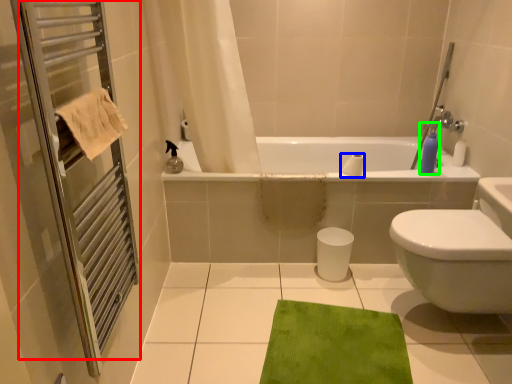
Question: Considering the real-world distances, which object is farthest from screen door (highlighted by a red box)? toilet paper (highlighted by a blue box) or soap dispenser (highlighted by a green box)?

Choices:
 (A) toilet paper
 (B) soap dispenser

Answer: (B)